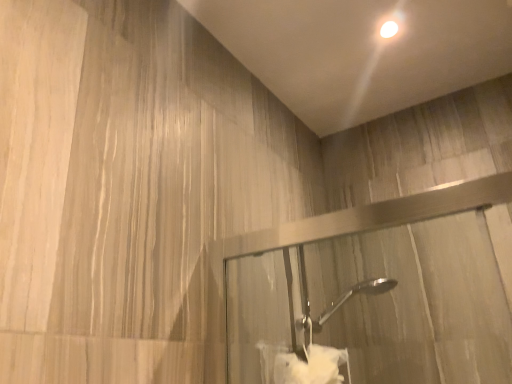
At what (x,y) coordinates should I click in order to perform the action: click on white glossy droplight at upper center. Please return your answer as a coordinate pair (x, y). Looking at the image, I should click on (389, 29).

What do you see at coordinates (389, 29) in the screenshot? I see `white glossy droplight at upper center` at bounding box center [389, 29].

At what (x,y) coordinates should I click in order to perform the action: click on white soft towel at lower center. Please return your answer as a coordinate pair (x, y). The height and width of the screenshot is (384, 512). Looking at the image, I should click on (302, 365).

The height and width of the screenshot is (384, 512). What do you see at coordinates (302, 365) in the screenshot?
I see `white soft towel at lower center` at bounding box center [302, 365].

Find the location of a particular element. This screenshot has height=384, width=512. white glossy droplight at upper center is located at coordinates (389, 29).

Which object is positioned more to the right, white glossy droplight at upper center or white soft towel at lower center?

Positioned to the right is white glossy droplight at upper center.

Is white glossy droplight at upper center behind white soft towel at lower center?

Yes, white glossy droplight at upper center is behind white soft towel at lower center.

Is point (386, 24) more distant than point (265, 362)?

Yes, point (386, 24) is farther from viewer.

From the image's perspective, would you say white glossy droplight at upper center is shown under white soft towel at lower center?

No, from the image's perspective, white glossy droplight at upper center is not below white soft towel at lower center.

From a real-world perspective, is white glossy droplight at upper center positioned under white soft towel at lower center based on gravity?

No, from a real-world perspective, white glossy droplight at upper center is not beneath white soft towel at lower center.

Considering the sizes of objects white glossy droplight at upper center and white soft towel at lower center in the image provided, who is thinner, white glossy droplight at upper center or white soft towel at lower center?

white glossy droplight at upper center.

Which of these two, white glossy droplight at upper center or white soft towel at lower center, stands taller?

Standing taller between the two is white soft towel at lower center.

Between white glossy droplight at upper center and white soft towel at lower center, which one has smaller size?

Smaller between the two is white glossy droplight at upper center.

Is white glossy droplight at upper center completely or partially outside of white soft towel at lower center?

Yes, white glossy droplight at upper center is outside of white soft towel at lower center.

Are white glossy droplight at upper center and white soft towel at lower center located far from each other?

white glossy droplight at upper center is near white soft towel at lower center, not far away.

Is white glossy droplight at upper center aimed at white soft towel at lower center?

No, white glossy droplight at upper center does not turn towards white soft towel at lower center.

Measure the distance between white glossy droplight at upper center and white soft towel at lower center.

37.46 inches.

Image resolution: width=512 pixels, height=384 pixels. In the image, there is a white glossy droplight at upper center. What are the coordinates of `bath towel below it (from the image's perspective)` in the screenshot? It's located at (302, 365).

Looking at this image, considering the positions of objects white soft towel at lower center and white glossy droplight at upper center in the image provided, who is more to the right, white soft towel at lower center or white glossy droplight at upper center?

From the viewer's perspective, white glossy droplight at upper center appears more on the right side.

Relative to white glossy droplight at upper center, is white soft towel at lower center in front or behind?

Result: white soft towel at lower center is positioned closer to the viewer than white glossy droplight at upper center.

Does point (317, 348) appear closer or farther from the camera than point (392, 26)?

Point (317, 348).

From the image's perspective, who appears lower, white soft towel at lower center or white glossy droplight at upper center?

white soft towel at lower center appears lower in the image.

In the scene shown: From a real-world perspective, is white soft towel at lower center located higher than white glossy droplight at upper center?

No.

Which object is wider, white soft towel at lower center or white glossy droplight at upper center?

With larger width is white soft towel at lower center.

Between white soft towel at lower center and white glossy droplight at upper center, which one has less height?

white glossy droplight at upper center.

Between white soft towel at lower center and white glossy droplight at upper center, which one has larger size?

white soft towel at lower center.

Is white soft towel at lower center inside or outside of white glossy droplight at upper center?

white soft towel at lower center is located beyond the bounds of white glossy droplight at upper center.

Is white soft towel at lower center not near white glossy droplight at upper center?

white soft towel at lower center is near white glossy droplight at upper center, not far away.

Is white soft towel at lower center facing away from white glossy droplight at upper center?

That's not correct — white soft towel at lower center is not looking away from white glossy droplight at upper center.

How different are the orientations of white soft towel at lower center and white glossy droplight at upper center in degrees?

The facing directions of white soft towel at lower center and white glossy droplight at upper center are 90.2 degrees apart.

I want to click on bath towel below the white glossy droplight at upper center (from a real-world perspective), so click(302, 365).

At what (x,y) coordinates should I click in order to perform the action: click on bath towel located on the left of white glossy droplight at upper center. Please return your answer as a coordinate pair (x, y). The height and width of the screenshot is (384, 512). Looking at the image, I should click on (302, 365).

Find the location of a particular element. This screenshot has width=512, height=384. droplight behind the white soft towel at lower center is located at coordinates (389, 29).